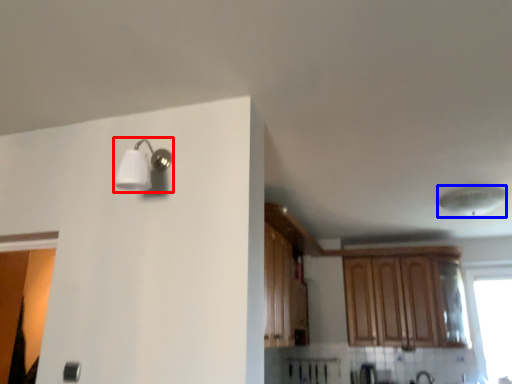
Question: Which object is closer to the camera taking this photo, light fixture (highlighted by a red box) or lamp (highlighted by a blue box)?

Choices:
 (A) light fixture
 (B) lamp

Answer: (A)